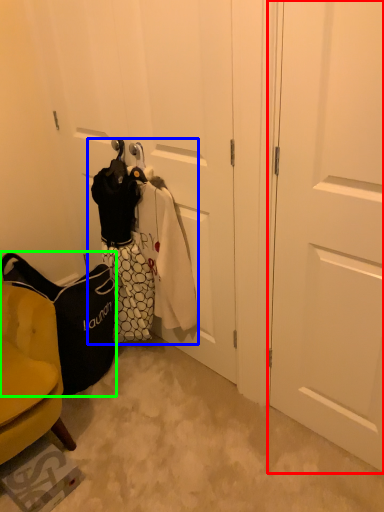
Question: Which is nearer to the door (highlighted by a red box)? laundry (highlighted by a blue box) or handbag (highlighted by a green box).

Choices:
 (A) laundry
 (B) handbag

Answer: (A)